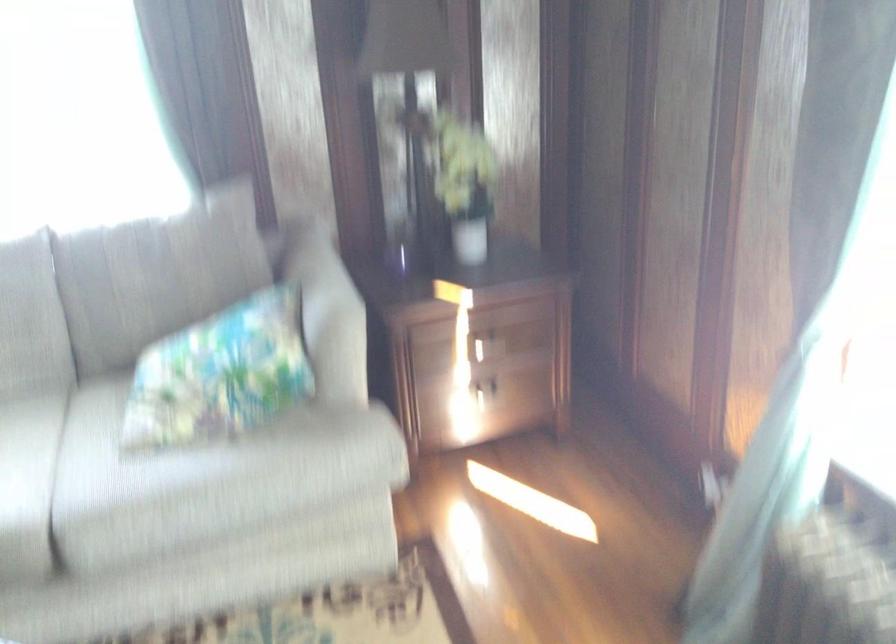
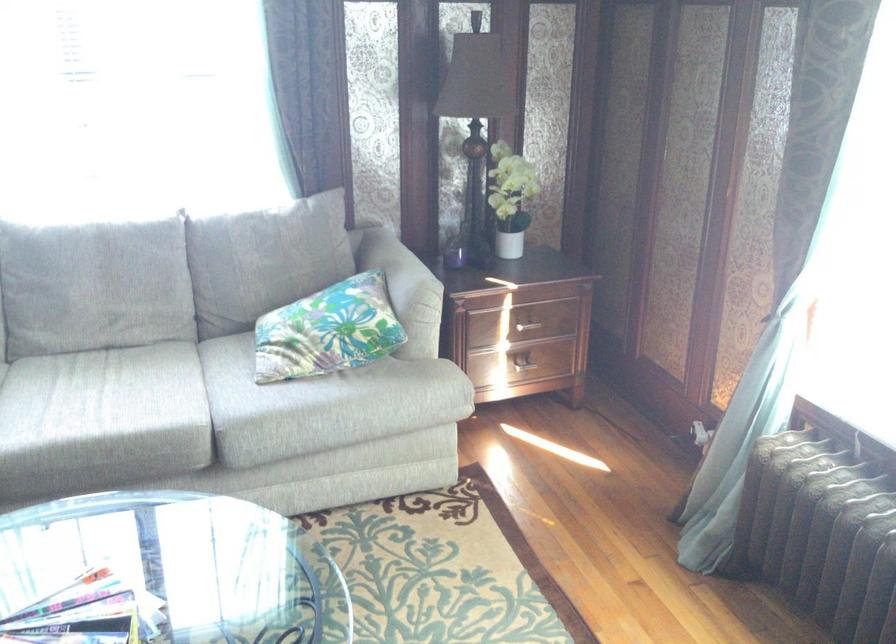
Where in the second image is the point corresponding to point (221, 375) from the first image?

(328, 330)